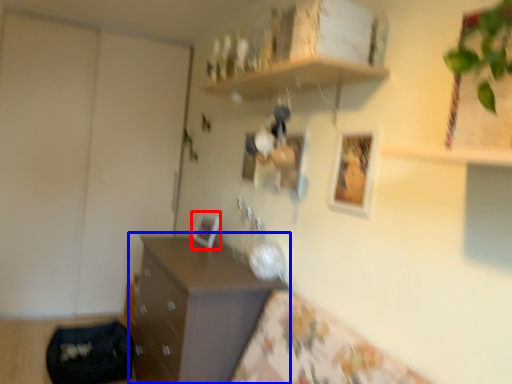
Question: Which of the following is the closest to the observer, picture frame (highlighted by a red box) or chest of drawers (highlighted by a blue box)?

Choices:
 (A) picture frame
 (B) chest of drawers

Answer: (B)